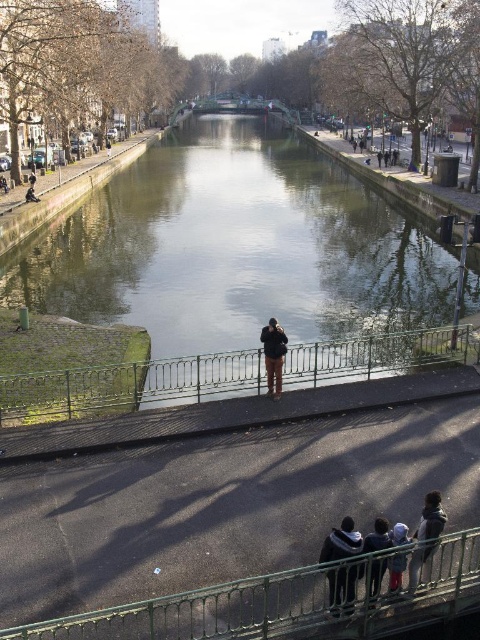
You are standing at the point closer to the camera between the two points, point (x=317, y=337) and point (x=351, y=554). If you want to walk towards the point further away, which direction should you move?

You should move towards point (x=351, y=554) because it is further away from the camera compared to point (x=317, y=337).

In the scene shown: What is the exact coordinate of the green concrete river at center?

The green concrete river at center is located at point [238,257].